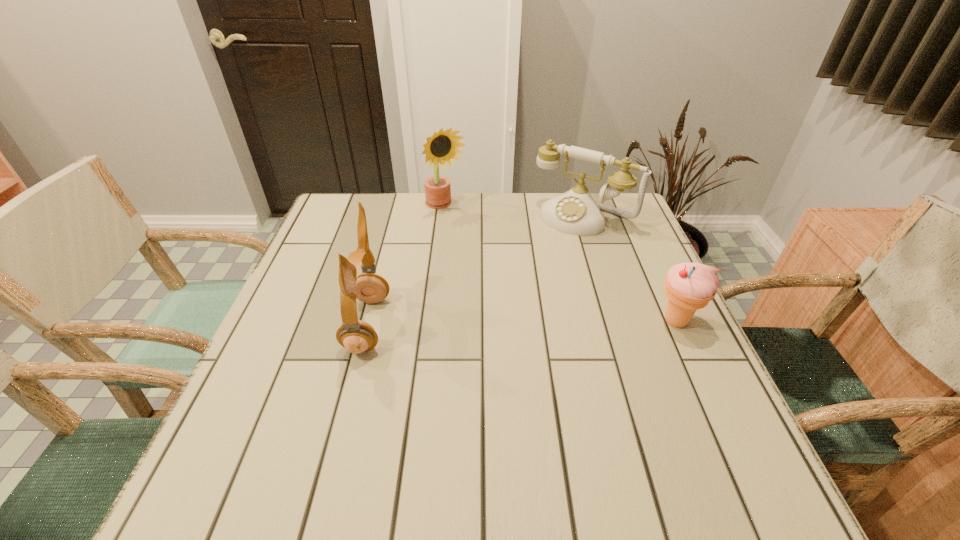
The height and width of the screenshot is (540, 960). I want to click on empty location between the earphone and the icecream, so click(521, 323).

The width and height of the screenshot is (960, 540). Find the location of `free space that is in between the earphone and the telephone`. free space that is in between the earphone and the telephone is located at coordinates (475, 271).

Where is `vacant area that lies between the telephone and the leftmost object`? The image size is (960, 540). vacant area that lies between the telephone and the leftmost object is located at coordinates (475, 271).

The width and height of the screenshot is (960, 540). I want to click on vacant area that lies between the telephone and the earphone, so click(x=475, y=271).

Locate which object is the closest to the sunflower. Please provide its 2D coordinates. Your answer should be formatted as a tuple, i.e. [(x, y)], where the tuple contains the x and y coordinates of a point satisfying the conditions above.

[(575, 212)]

Find the location of a particular element. The width and height of the screenshot is (960, 540). the second closest object relative to the icecream is located at coordinates (442, 147).

Find the location of `vacant space that satisfies the following two spatial constraints: 1. on the front side of the icecream; 2. on the right side of the sunflower`. vacant space that satisfies the following two spatial constraints: 1. on the front side of the icecream; 2. on the right side of the sunflower is located at coordinates (435, 321).